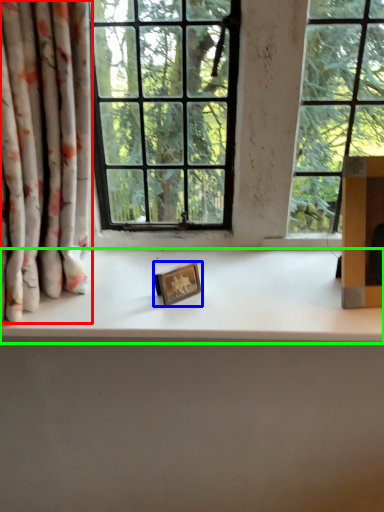
Question: Based on their relative distances, which object is farther from curtain (highlighted by a red box)? Choose from picture frame (highlighted by a blue box) and counter top (highlighted by a green box).

Choices:
 (A) picture frame
 (B) counter top

Answer: (A)